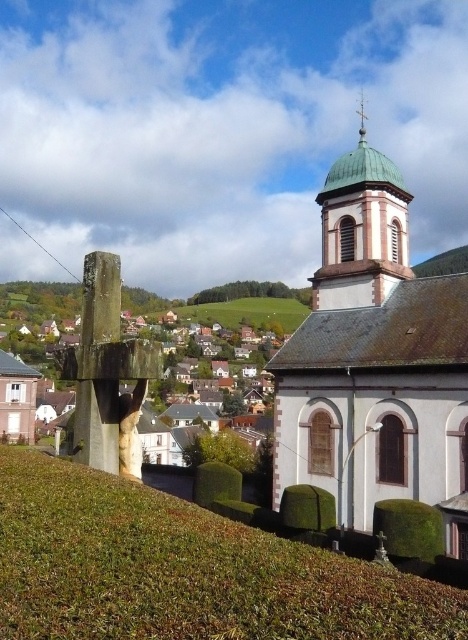
You are a landscape architect designing a pathway between the green leafy hedge at lower center and the green copper dome at upper right. Which object requires more space in terms of width for the pathway design?

The green leafy hedge at lower center might be wider than the green copper dome at upper right, so the pathway should be designed to accommodate the width of the green leafy hedge at lower center to ensure sufficient space.

You are standing at the point marked as point (x=394, y=225) in the image. You want to walk to the church with the green dome. Is the church with the green dome in front of you or behind you?

The church with the green dome is in front of you because you are at point (x=394, y=225), which is 36.97 meters away from the viewer. Since the church is the central structure in the scene, it is likely positioned in the direction you are facing towards the foreground.

You are standing in the foreground of the rural landscape scene. You want to locate the green copper dome at upper center. According to the coordinates provided, where should you look relative to the center of the image?

The green copper dome at upper center is located at point 0.362 on the x axis and 0.774 on the y axis, which means it is positioned to the left and above the center of the image.